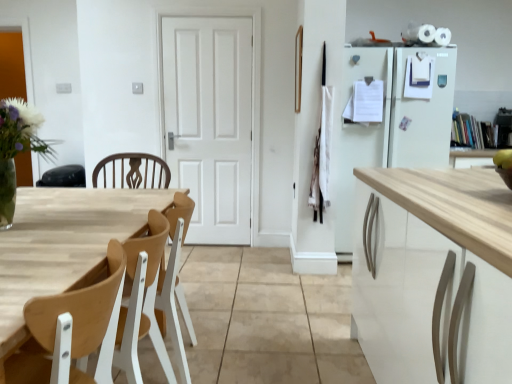
Question: From a real-world perspective, is wooden at left located beneath wooden table at left?

Choices:
 (A) yes
 (B) no

Answer: (B)

Question: From the image's perspective, would you say wooden at left is positioned over wooden table at left?

Choices:
 (A) no
 (B) yes

Answer: (B)

Question: Can you confirm if wooden at left is shorter than wooden table at left?

Choices:
 (A) yes
 (B) no

Answer: (A)

Question: Does wooden at left have a greater height compared to wooden table at left?

Choices:
 (A) yes
 (B) no

Answer: (B)

Question: Does wooden at left lie in front of wooden table at left?

Choices:
 (A) yes
 (B) no

Answer: (B)

Question: From the image's perspective, is wooden at left beneath wooden table at left?

Choices:
 (A) no
 (B) yes

Answer: (A)

Question: Can you confirm if wooden table at left is smaller than clear glass vase at left?

Choices:
 (A) yes
 (B) no

Answer: (B)

Question: Considering the relative sizes of wooden table at left and clear glass vase at left in the image provided, is wooden table at left taller than clear glass vase at left?

Choices:
 (A) no
 (B) yes

Answer: (B)

Question: Is wooden table at left positioned beyond the bounds of clear glass vase at left?

Choices:
 (A) no
 (B) yes

Answer: (B)

Question: Does wooden table at left have a lesser width compared to clear glass vase at left?

Choices:
 (A) no
 (B) yes

Answer: (A)

Question: Considering the relative sizes of wooden table at left and clear glass vase at left in the image provided, is wooden table at left wider than clear glass vase at left?

Choices:
 (A) yes
 (B) no

Answer: (A)

Question: From the image's perspective, is wooden table at left below clear glass vase at left?

Choices:
 (A) no
 (B) yes

Answer: (B)

Question: Is wooden table at left closer to camera compared to wooden at left?

Choices:
 (A) no
 (B) yes

Answer: (B)